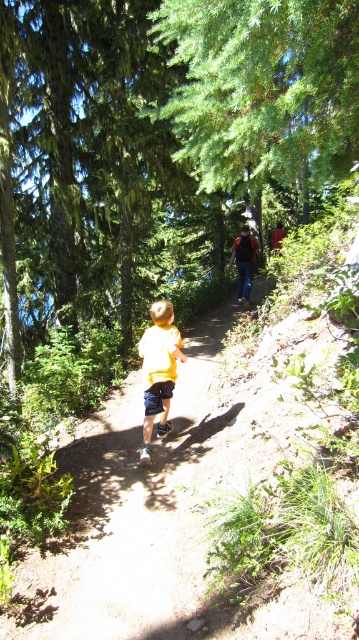
You are a parent trying to locate your child in the forest. You see a yellow fabric child at center and a yellow matte shirt at center. Which one is positioned to the left?

The yellow fabric child at center is positioned to the left of the yellow matte shirt at center.

You are a parent trying to find your child in a forest. You see a yellow fabric child at center and a yellow matte shirt at center. Which one is narrower?

The yellow fabric child at center is narrower than the yellow matte shirt at center.

You are a parent trying to locate your child in a forest. You see a yellow fabric child at center and a yellow matte shirt at center. Which object is more likely to be your child?

The yellow fabric child at center is more likely to be your child, as it is smaller than the yellow matte shirt at center, which may be an object or a misinterpretation.